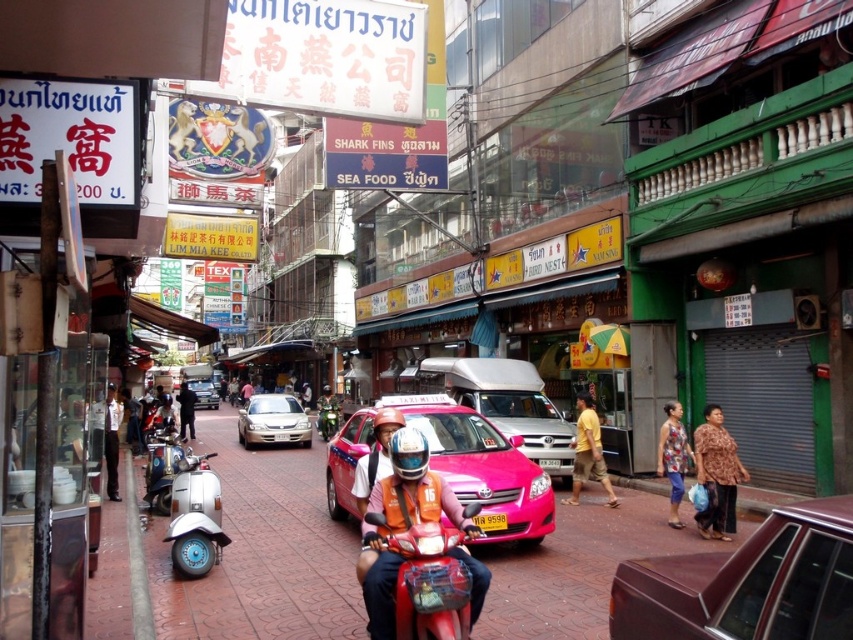
You are a delivery person trying to navigate through the bustling street scene. You need to deliver a package to a location marked by point (368,513). However, there is an obstacle at point (202,385). Can you safely go around the obstacle to reach your destination?

Point (368,513) is in front of point (202,385), so you can safely navigate around the obstacle at point (202,385) to reach your destination at point (368,513).

You are a delivery person needing to park your vehicle. You see a shiny red motorcycle at center and a metallic silver sedan at center. Which vehicle is easier to park in this narrow alley?

The shiny red motorcycle at center is easier to park because it is closer to the viewer and likely occupies less space than the metallic silver sedan at center.